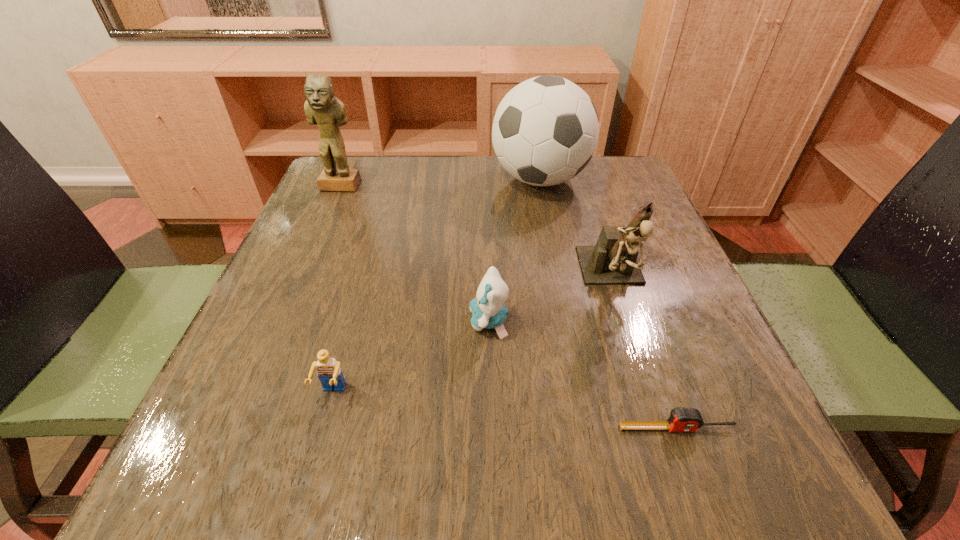
You are a GUI agent. You are given a task and a screenshot of the screen. Output one action in this format:
    pyautogui.click(x=<x>, y=<y>)
    Task: Click on the vacant space situated 0.250m on the front-facing side of the leftmost object
    
    Given the screenshot: What is the action you would take?
    pyautogui.click(x=308, y=261)

Identify the location of vacant point located 0.180m on the left of the soccer ball. (421, 179).

The image size is (960, 540). I want to click on vacant space located on the front-facing side of the right figurine, so click(679, 480).

You are a GUI agent. You are given a task and a screenshot of the screen. Output one action in this format:
    pyautogui.click(x=<x>, y=<y>)
    Task: Click on the vacant area located 0.180m on the face of the third shortest object
    The width and height of the screenshot is (960, 540).
    Given the screenshot: What is the action you would take?
    pyautogui.click(x=368, y=321)

Identify the location of vacant space located 0.230m on the face of the third shortest object. The height and width of the screenshot is (540, 960). (340, 321).

This screenshot has width=960, height=540. In order to click on vacant space located 0.190m on the face of the third shortest object in this screenshot , I will do `click(363, 321)`.

Where is `vacant space located on the face of the fifth object from right to left`? vacant space located on the face of the fifth object from right to left is located at coordinates (317, 452).

You are a GUI agent. You are given a task and a screenshot of the screen. Output one action in this format:
    pyautogui.click(x=<x>, y=<y>)
    Task: Click on the vacant space located on the front of the nearest object
    Image resolution: width=960 pixels, height=540 pixels.
    Given the screenshot: What is the action you would take?
    pyautogui.click(x=699, y=494)

Locate an element on the screen. Image resolution: width=960 pixels, height=540 pixels. figurine located at the far edge is located at coordinates (322, 108).

The height and width of the screenshot is (540, 960). Find the location of `soccer ball that is at the far edge`. soccer ball that is at the far edge is located at coordinates (545, 131).